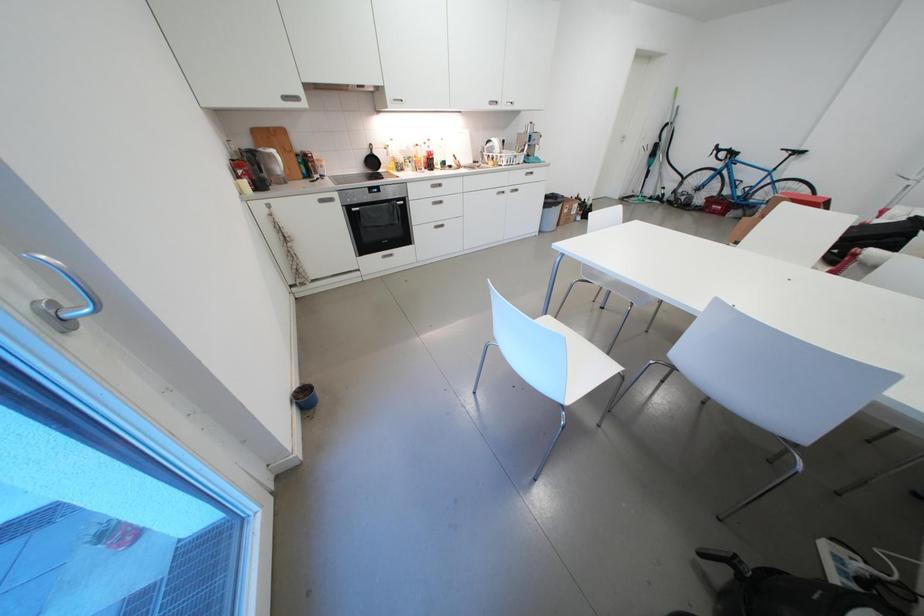
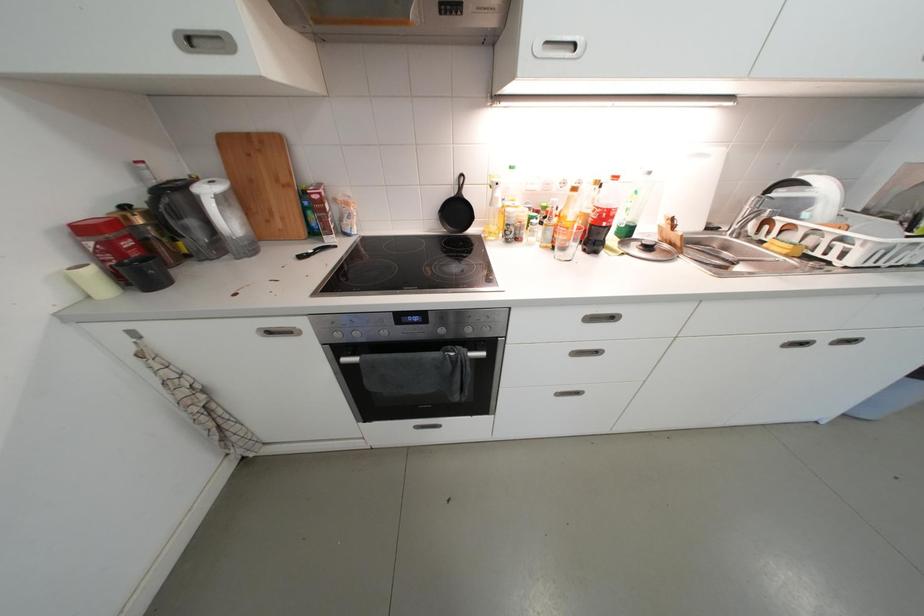
Question: Which direction would the cameraman need to move to produce the second image? Reply with the corresponding letter.

Choices:
 (A) Left
 (B) Right
 (C) Forward
 (D) Backward

Answer: (C)